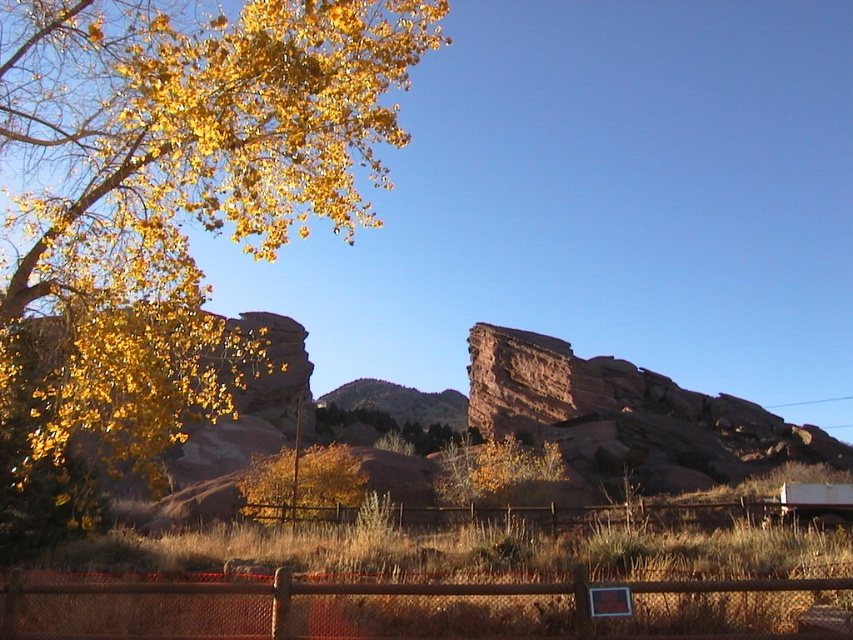
Who is taller, rustic brown rock at center or brown wooden fence at center?

Standing taller between the two is rustic brown rock at center.

Measure the distance between point (x=602, y=397) and camera.

A distance of 90.22 meters exists between point (x=602, y=397) and camera.

Where is `rustic brown rock at center`? The image size is (853, 640). rustic brown rock at center is located at coordinates (627, 417).

What do you see at coordinates (163, 212) in the screenshot? I see `golden leafy tree at upper left` at bounding box center [163, 212].

Locate an element on the screen. The height and width of the screenshot is (640, 853). golden leafy tree at upper left is located at coordinates (163, 212).

Where is `golden leafy tree at upper left`? Image resolution: width=853 pixels, height=640 pixels. golden leafy tree at upper left is located at coordinates (163, 212).

Does brown wooden fence at center appear on the left side of golden leafy tree at center?

In fact, brown wooden fence at center is to the right of golden leafy tree at center.

Who is more distant from viewer, (730,518) or (254,461)?

Positioned behind is point (254,461).

Who is more forward, (456, 509) or (328, 497)?

Positioned in front is point (456, 509).

At what (x,y) coordinates should I click in order to perform the action: click on brown wooden fence at center. Please return your answer as a coordinate pair (x, y). Image resolution: width=853 pixels, height=640 pixels. Looking at the image, I should click on (631, 515).